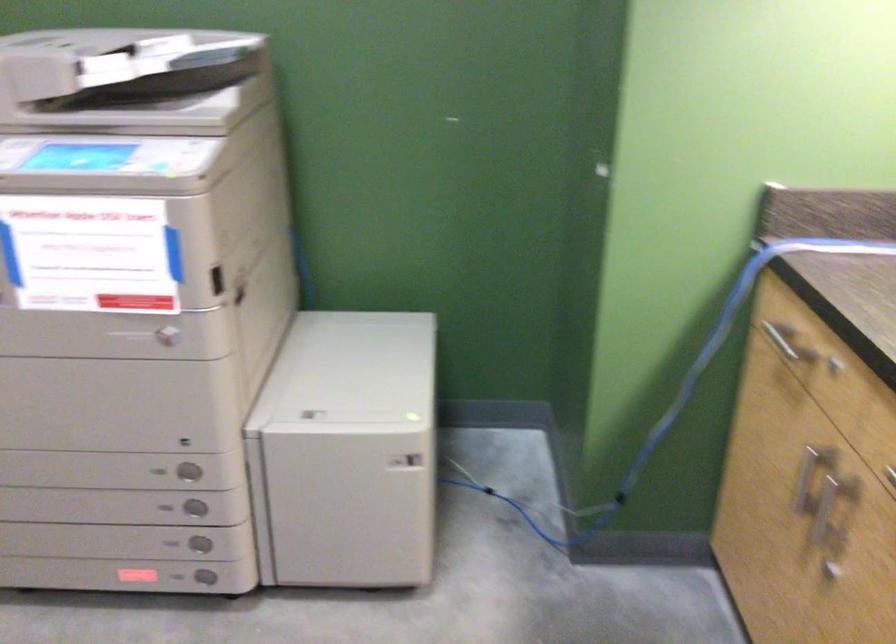
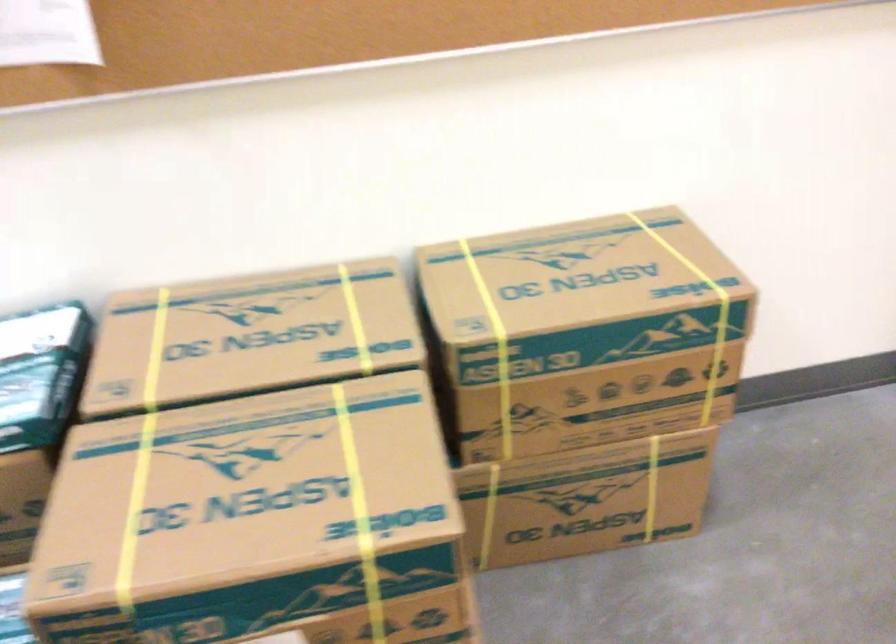
The first image is from the beginning of the video and the second image is from the end. How did the camera likely rotate when shooting the video?

The camera's rotation is toward left-down.